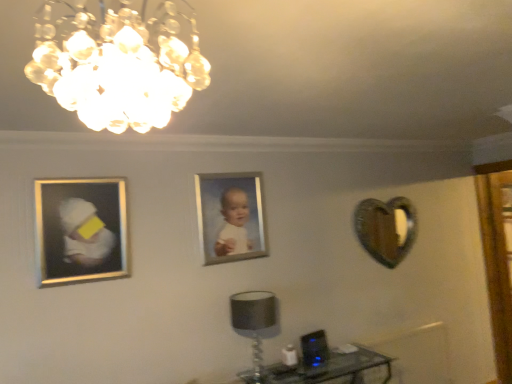
Question: From their relative heights in the image, would you say transparent glass table at lower right is taller or shorter than clear glass chandelier at upper center?

Choices:
 (A) tall
 (B) short

Answer: (A)

Question: Is transparent glass table at lower right inside or outside of clear glass chandelier at upper center?

Choices:
 (A) outside
 (B) inside

Answer: (A)

Question: Which object is positioned closest to the silver metallic picture frame at center, positioned as the 2th picture frame in left-to-right order?

Choices:
 (A) matte black lampshade at lower center
 (B) silver/metallic picture frame at left, marked as the 2th picture frame in a back-to-front arrangement
 (C) transparent glass table at lower right
 (D) metallic heart-shaped mirror at right
 (E) clear glass chandelier at upper center

Answer: (A)

Question: Which is farther from the clear glass chandelier at upper center?

Choices:
 (A) silver metallic picture frame at center, the 1th picture frame viewed from the right
 (B) matte black lampshade at lower center
 (C) transparent glass table at lower right
 (D) metallic heart-shaped mirror at right
 (E) silver/metallic picture frame at left, marked as the 2th picture frame in a back-to-front arrangement

Answer: (D)